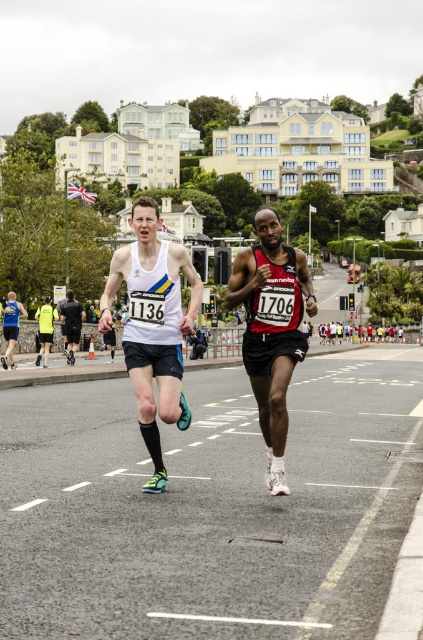
You are a photographer positioned at the center of the image. You want to focus your camera on the white matte tank top at center. What are the coordinates of the point you should aim for?

The coordinates of the white matte tank top at center are at point (153, 324).

You are a photographer positioned at the camera location capturing this race scene. You want to focus on the two points in the image labeled as point (299, 336) and point (77, 320). Which point should you adjust your focus to first if you want to capture the closest one to the camera?

Point (299, 336) is closer to the camera than point (77, 320), so you should focus on point (299, 336) first.